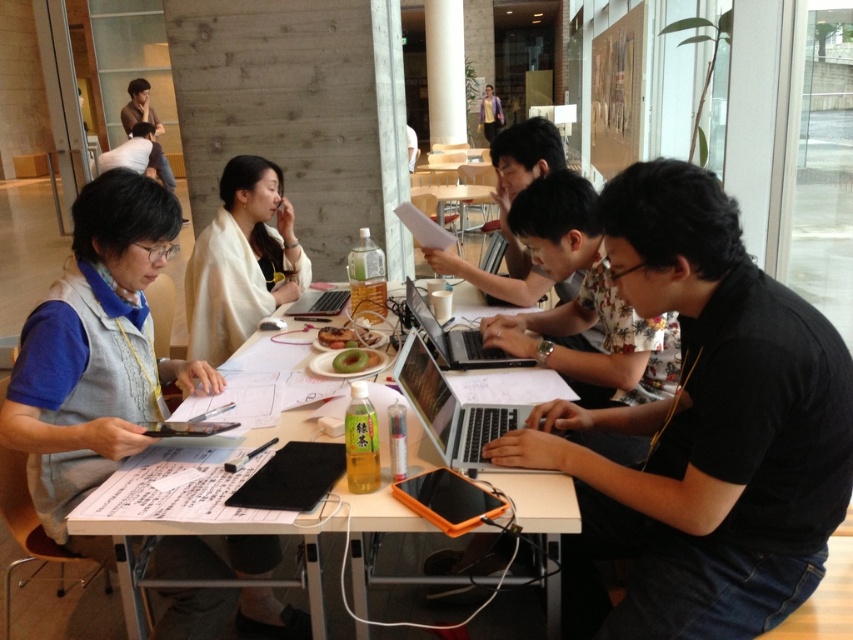
Can you confirm if black matte shirt at center is shorter than white paper at center?

No.

What are the coordinates of `black matte shirt at center` in the screenshot? It's located at coord(701,432).

Is point (682, 211) positioned in front of point (363, 605)?

Yes, it is in front of point (363, 605).

Where is `black matte shirt at center`? black matte shirt at center is located at coordinates (701, 432).

From the picture: Which is above, black matte shirt at center or green matte kiwi at center?

green matte kiwi at center is higher up.

Who is positioned more to the right, black matte shirt at center or green matte kiwi at center?

Positioned to the right is black matte shirt at center.

Which is behind, point (779, 476) or point (349, 364)?

Point (349, 364)

Image resolution: width=853 pixels, height=640 pixels. What are the coordinates of `black matte shirt at center` in the screenshot? It's located at (701, 432).

Between point (308, 429) and point (408, 284), which one is positioned in front?

Point (308, 429) is in front.

Between white paper at center and silver metallic laptop at center, which one has more height?

white paper at center is taller.

At what (x,y) coordinates should I click in order to perform the action: click on white paper at center. Please return your answer as a coordinate pair (x, y). The image size is (853, 640). Looking at the image, I should click on (218, 529).